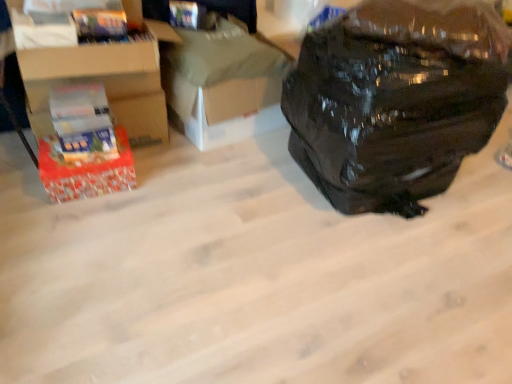
Locate an element on the screen. vacant space in front of black matte backpack at right is located at coordinates (380, 278).